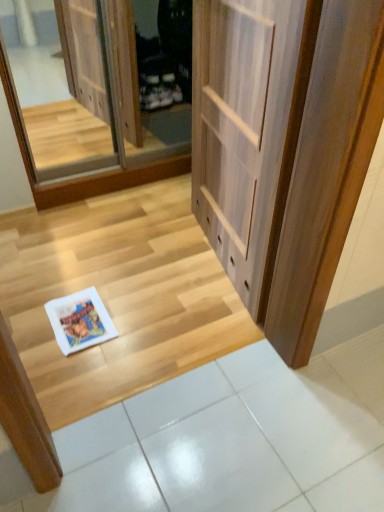
Find the location of a particular element. space that is in front of white paper magazine at lower left is located at coordinates (77, 370).